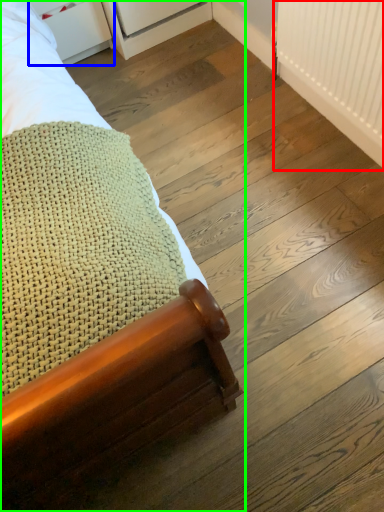
Question: Based on their relative distances, which object is nearer to radiator (highlighted by a red box)? Choose from drawer (highlighted by a blue box) and bed (highlighted by a green box).

Choices:
 (A) drawer
 (B) bed

Answer: (B)